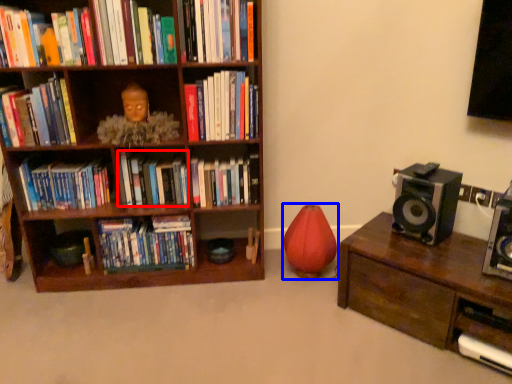
Question: Which object is further to the camera taking this photo, book (highlighted by a red box) or toy (highlighted by a blue box)?

Choices:
 (A) book
 (B) toy

Answer: (A)